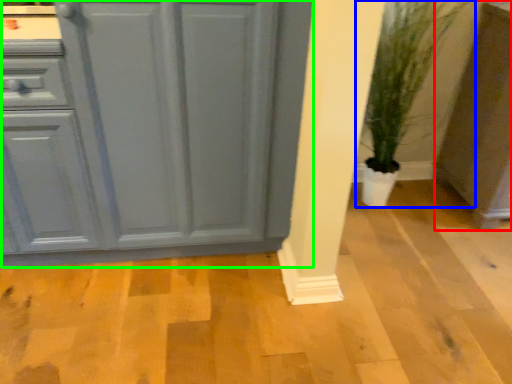
Question: Which is farther away from cabinetry (highlighted by a red box)? houseplant (highlighted by a blue box) or cabinetry (highlighted by a green box)?

Choices:
 (A) houseplant
 (B) cabinetry

Answer: (B)